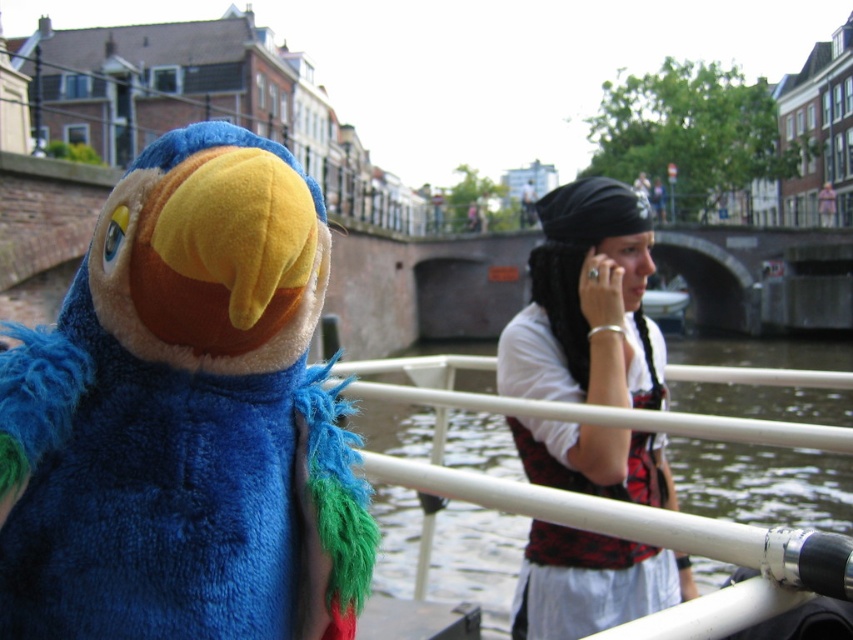
Question: Which object appears farthest from the camera in this image?

Choices:
 (A) matte black vest at center
 (B) green fuzzy water at lower center

Answer: (A)

Question: Can you confirm if blue plush parrot at left is smaller than green fuzzy water at lower center?

Choices:
 (A) no
 (B) yes

Answer: (A)

Question: Based on their relative distances, which object is farther from the green fuzzy water at lower center?

Choices:
 (A) matte black vest at center
 (B) blue plush parrot at left

Answer: (A)

Question: Does blue plush parrot at left appear on the left side of matte black vest at center?

Choices:
 (A) no
 (B) yes

Answer: (B)

Question: Which point is farther to the camera?

Choices:
 (A) (788, 596)
 (B) (138, 464)
 (C) (585, 333)

Answer: (C)

Question: In this image, where is blue plush parrot at left located relative to green fuzzy water at lower center?

Choices:
 (A) below
 (B) above

Answer: (B)